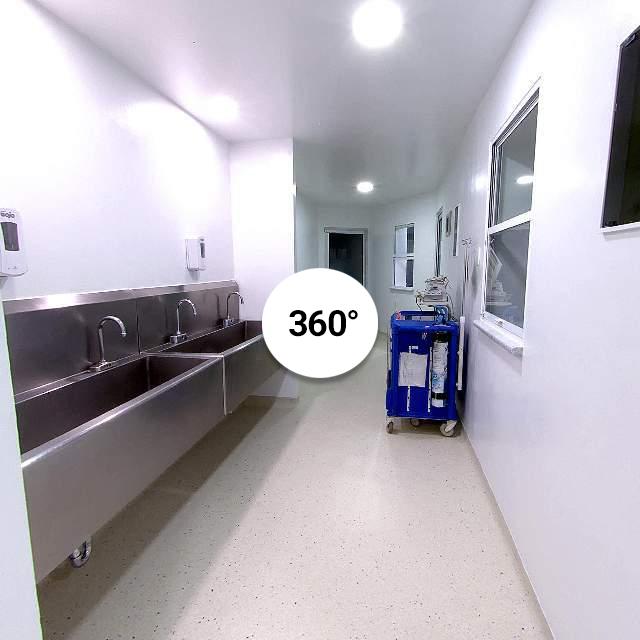
Identify the location of light. (376, 31), (364, 187), (212, 115).